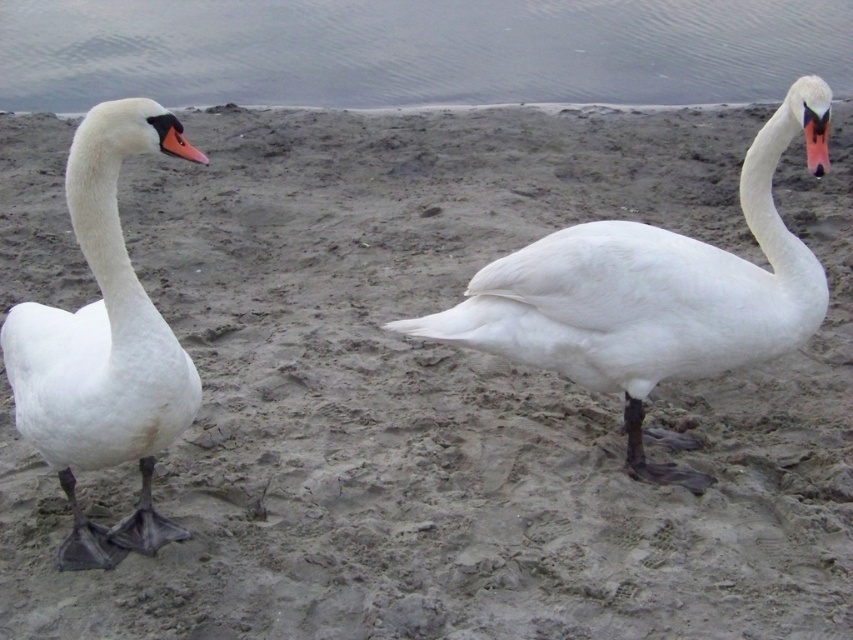
Question: Which point is farther to the camera?

Choices:
 (A) white matte swan at center
 (B) matte orange beak at upper right
 (C) smooth water at upper center

Answer: (C)

Question: Which object appears closest to the camera in this image?

Choices:
 (A) white matte swan at center
 (B) matte orange beak at upper right
 (C) matte orange beak at left
 (D) white matte swan at left

Answer: (C)

Question: Can you confirm if smooth water at upper center is thinner than white matte swan at left?

Choices:
 (A) yes
 (B) no

Answer: (B)

Question: Among these points, which one is nearest to the camera?

Choices:
 (A) (828, 166)
 (B) (186, 141)
 (C) (572, 342)
 (D) (157, 522)

Answer: (B)

Question: Can you confirm if smooth water at upper center is positioned to the left of white matte swan at center?

Choices:
 (A) yes
 (B) no

Answer: (A)

Question: Can you confirm if white matte swan at left is positioned to the left of matte orange beak at left?

Choices:
 (A) yes
 (B) no

Answer: (A)